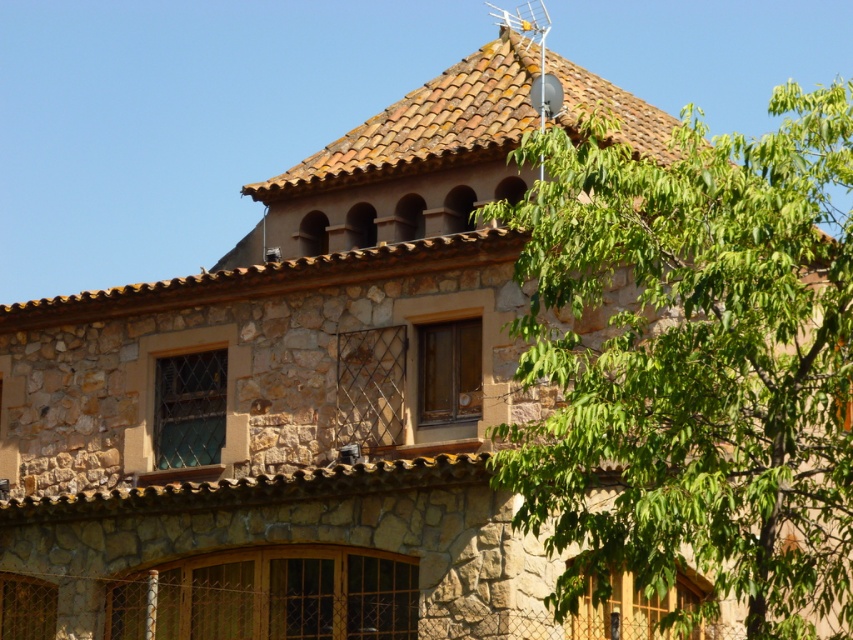
Is green leafy tree at upper right positioned before brown clay tiles at upper center?

Yes, it is in front of brown clay tiles at upper center.

Does green leafy tree at upper right have a lesser width compared to brown clay tiles at upper center?

In fact, green leafy tree at upper right might be wider than brown clay tiles at upper center.

Is point (592, 128) in front of point (350, 140)?

Yes.

You are a GUI agent. You are given a task and a screenshot of the screen. Output one action in this format:
    pyautogui.click(x=<x>, y=<y>)
    Task: Click on the green leafy tree at upper right
    Image resolution: width=853 pixels, height=640 pixels.
    Given the screenshot: What is the action you would take?
    pyautogui.click(x=694, y=362)